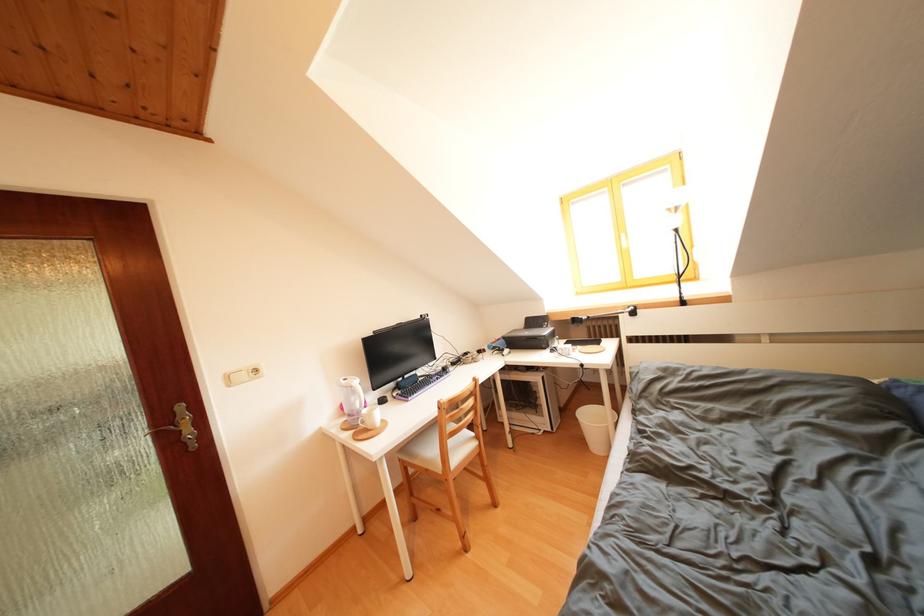
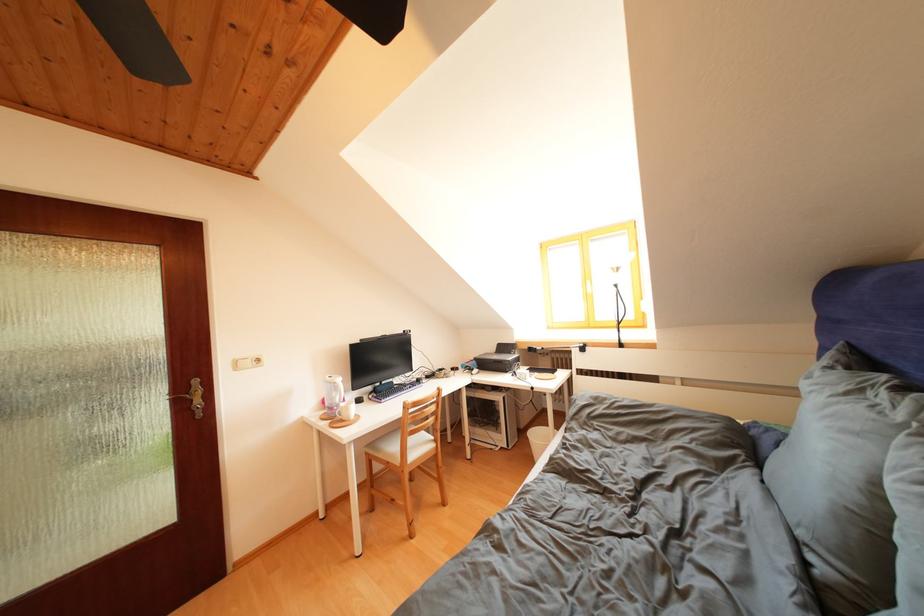
In the second image, find the point that corresponds to point 549,331 in the first image.

(517, 358)